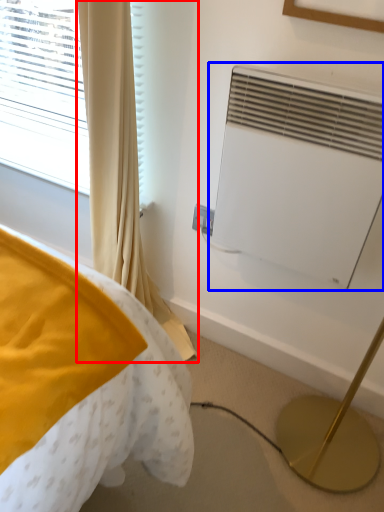
Question: Which of the following is the closest to the observer, curtain (highlighted by a red box) or air conditioning (highlighted by a blue box)?

Choices:
 (A) curtain
 (B) air conditioning

Answer: (A)